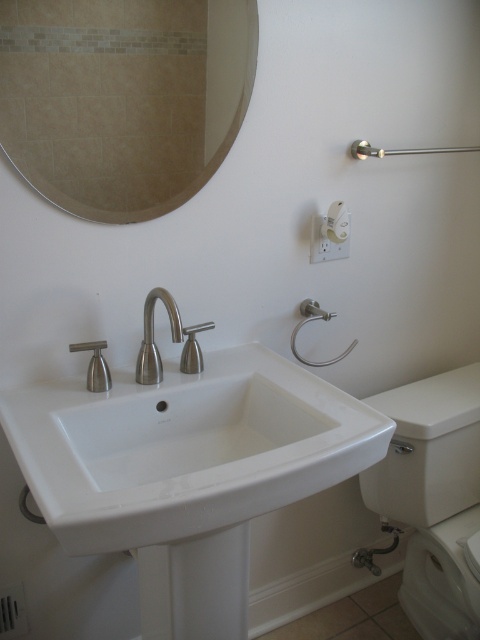
Can you confirm if beige tile mirror at upper left is positioned below brushed metal faucet at center?

No, beige tile mirror at upper left is not below brushed metal faucet at center.

Is beige tile mirror at upper left positioned behind brushed metal faucet at center?

That is False.

Is point (94, 161) farther from camera compared to point (135, 380)?

No, (94, 161) is closer to viewer.

This screenshot has width=480, height=640. Find the location of `beige tile mirror at upper left`. beige tile mirror at upper left is located at coordinates (122, 99).

Consider the image. Is white ceramic sink at center wider than white glossy toilet bowl at lower right?

Yes.

Is white ceramic sink at center taller than white glossy toilet bowl at lower right?

No, white ceramic sink at center is not taller than white glossy toilet bowl at lower right.

Locate an element on the screen. The image size is (480, 640). white ceramic sink at center is located at coordinates (184, 448).

Image resolution: width=480 pixels, height=640 pixels. I want to click on white ceramic sink at center, so click(184, 448).

Does point (63, 460) come behind point (219, 67)?

No.

What do you see at coordinates (184, 448) in the screenshot? I see `white ceramic sink at center` at bounding box center [184, 448].

Who is more forward, (33, 429) or (40, 147)?

Point (33, 429) is in front.

At what (x,y) coordinates should I click in order to perform the action: click on white ceramic sink at center. Please return your answer as a coordinate pair (x, y). This screenshot has width=480, height=640. Looking at the image, I should click on (184, 448).